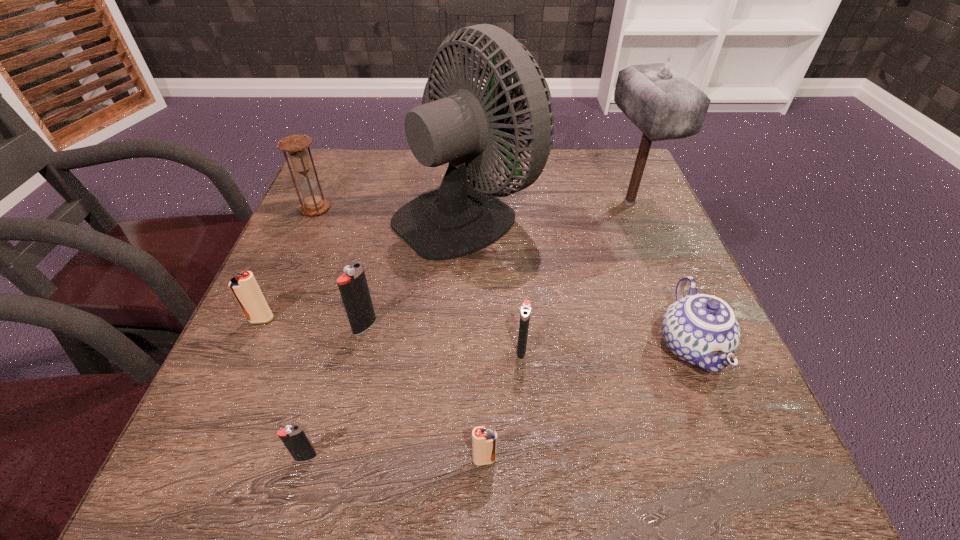
The height and width of the screenshot is (540, 960). What are the coordinates of `free space located on the back of the bigger red igniter` in the screenshot? It's located at (312, 207).

Locate an element on the screen. The width and height of the screenshot is (960, 540). vacant area situated 0.120m from the spout of the blue chinaware is located at coordinates (742, 472).

Image resolution: width=960 pixels, height=540 pixels. In order to click on free region located 0.330m on the back of the smaller red igniter in this screenshot , I will do `click(483, 290)`.

The width and height of the screenshot is (960, 540). Find the location of `vacant area located on the back of the smallest black igniter`. vacant area located on the back of the smallest black igniter is located at coordinates (344, 321).

This screenshot has width=960, height=540. I want to click on fan that is at the far edge, so click(461, 217).

The width and height of the screenshot is (960, 540). Find the location of `mallet located at the far edge`. mallet located at the far edge is located at coordinates (664, 105).

At what (x,y) coordinates should I click in order to perform the action: click on hourglass that is positioned at the left edge. Please return your answer as a coordinate pair (x, y). Looking at the image, I should click on (296, 145).

I want to click on igniter that is at the left edge, so click(x=244, y=286).

You are a GUI agent. You are given a task and a screenshot of the screen. Output one action in this format:
    pyautogui.click(x=<x>, y=<y>)
    Task: Click on the mallet located at the right edge
    Image resolution: width=960 pixels, height=540 pixels.
    Given the screenshot: What is the action you would take?
    pyautogui.click(x=664, y=105)

You are a GUI agent. You are given a task and a screenshot of the screen. Output one action in this format:
    pyautogui.click(x=<x>, y=<y>)
    Task: Click on the chinaware positioned at the right edge
    The height and width of the screenshot is (540, 960).
    Given the screenshot: What is the action you would take?
    pyautogui.click(x=702, y=330)